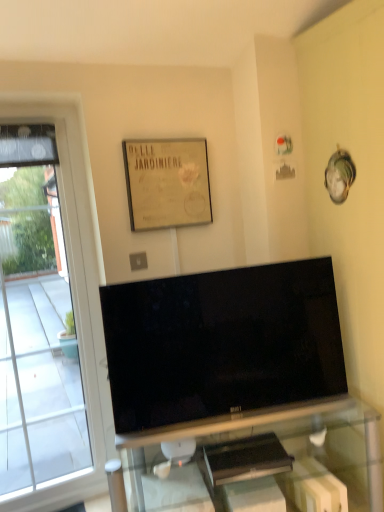
Question: Considering the positions of transparent glass window at left and transparent glass tv stand at center in the image, is transparent glass window at left bigger or smaller than transparent glass tv stand at center?

Choices:
 (A) big
 (B) small

Answer: (B)

Question: From the image's perspective, is transparent glass window at left located above or below transparent glass tv stand at center?

Choices:
 (A) below
 (B) above

Answer: (B)

Question: Which of these objects is positioned closest to the black glossy tv at center?

Choices:
 (A) beige paper picture frame at upper center
 (B) transparent glass window at left
 (C) transparent glass tv stand at center

Answer: (C)

Question: Based on their relative distances, which object is farther from the beige paper picture frame at upper center?

Choices:
 (A) transparent glass window at left
 (B) black glossy tv at center
 (C) transparent glass tv stand at center

Answer: (C)